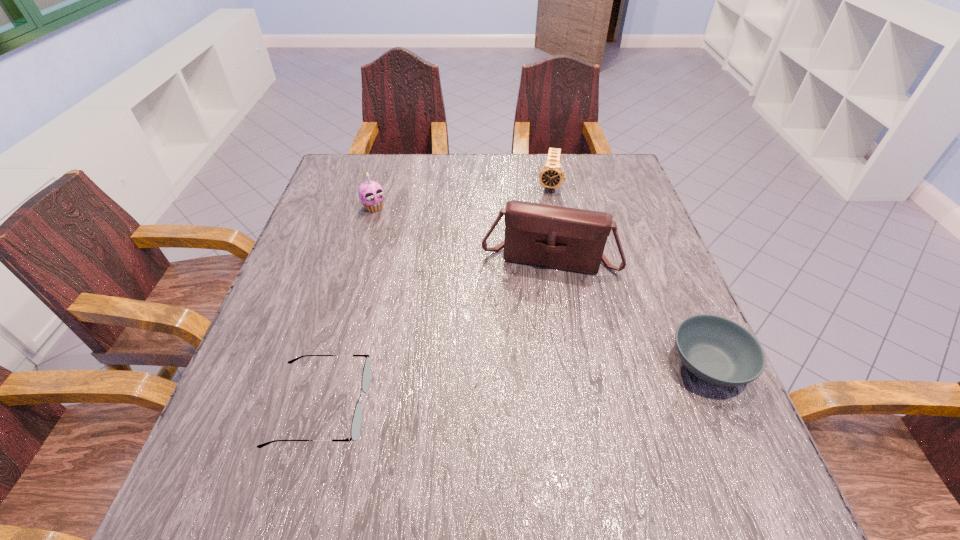
You are a GUI agent. You are given a task and a screenshot of the screen. Output one action in this format:
    pyautogui.click(x=<x>, y=<y>)
    Task: Click on the spectacles that is at the left edge
    This screenshot has height=540, width=960.
    Given the screenshot: What is the action you would take?
    pyautogui.click(x=366, y=375)

Identify the location of cupcake that is at the left edge. This screenshot has height=540, width=960. (371, 194).

Locate an element on the screen. This screenshot has width=960, height=540. soup bowl located in the right edge section of the desktop is located at coordinates (717, 350).

You are a GUI agent. You are given a task and a screenshot of the screen. Output one action in this format:
    pyautogui.click(x=<x>, y=<y>)
    Task: Click on the shoulder bag at the right edge
    
    Given the screenshot: What is the action you would take?
    pyautogui.click(x=564, y=238)

In order to click on object present at the near left corner in this screenshot , I will do `click(366, 375)`.

Identify the location of object that is positioned at the near right corner. This screenshot has width=960, height=540. (717, 350).

I want to click on free location at the far edge of the desktop, so click(x=505, y=184).

The height and width of the screenshot is (540, 960). What are the coordinates of `vacant area at the left edge` in the screenshot? It's located at (345, 293).

I want to click on free space at the right edge of the desktop, so click(626, 228).

Where is `free space at the far left corner`? free space at the far left corner is located at coordinates (370, 160).